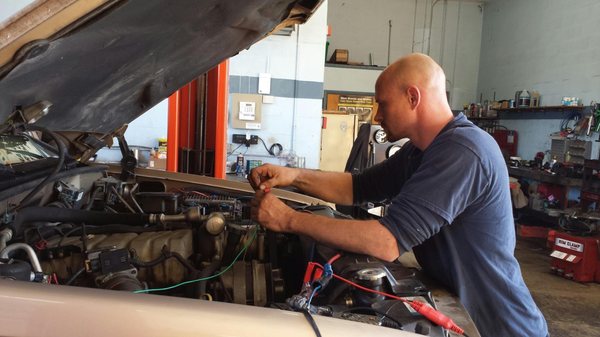
Where is `shelf`? This screenshot has height=337, width=600. shelf is located at coordinates (553, 107).